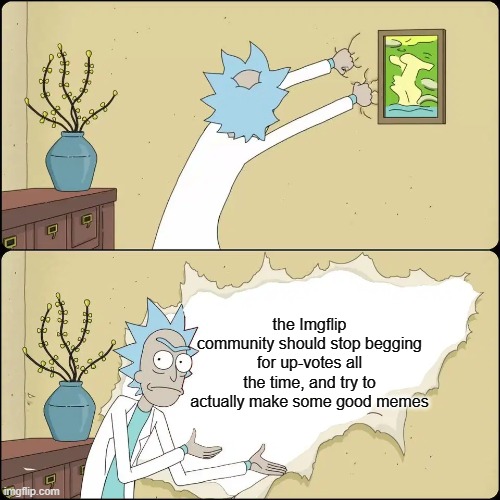
What are the coordinates of `black message under torn yellow wall paper` in the screenshot? It's located at (291, 342).